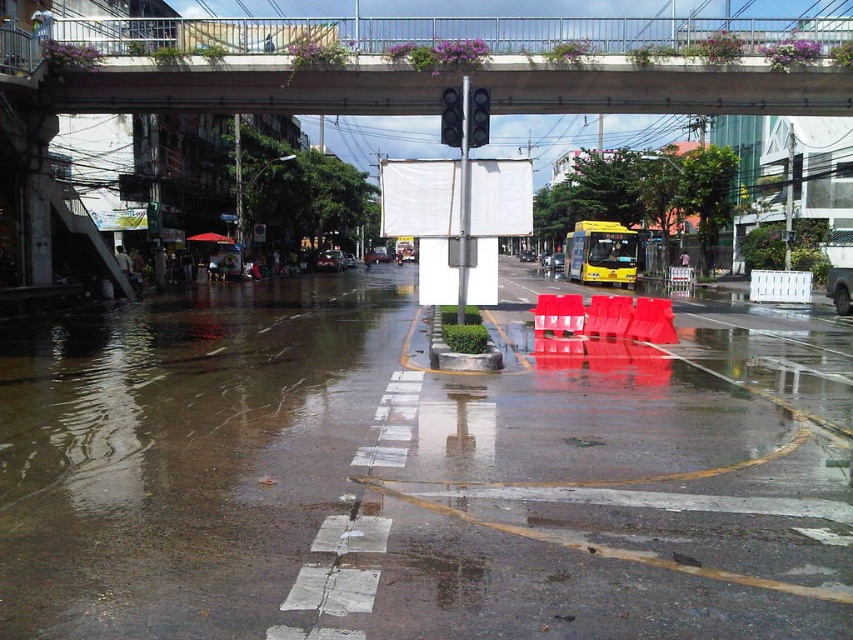
Question: In this image, where is concrete at upper center located relative to yellow matte school bus at center?

Choices:
 (A) below
 (B) above

Answer: (B)

Question: Can you confirm if brown concrete flood at lower left is smaller than concrete at upper center?

Choices:
 (A) yes
 (B) no

Answer: (A)

Question: Is the position of brown concrete flood at lower left more distant than that of black plastic traffic light at center?

Choices:
 (A) yes
 (B) no

Answer: (B)

Question: Estimate the real-world distances between objects in this image. Which object is closer to the transparent plastic barriers at center?

Choices:
 (A) concrete at upper center
 (B) black glass traffic light at upper center
 (C) black plastic traffic light at center
 (D) yellow matte school bus at center

Answer: (C)

Question: Which of the following is the closest to the observer?

Choices:
 (A) yellow matte school bus at center
 (B) black plastic traffic light at center
 (C) transparent plastic barriers at center

Answer: (C)

Question: Which point is closer to the camera taking this photo?

Choices:
 (A) (440, 138)
 (B) (473, 401)

Answer: (B)